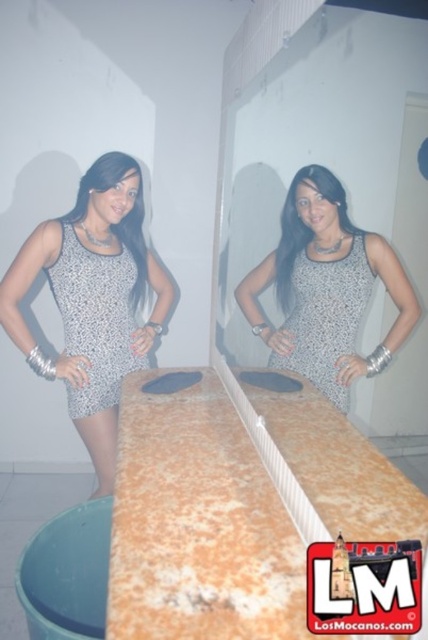
Where is the silver metallic dress at center located in the image? Please provide its coordinates as a point in the format of a tuple like this example format of 2D coordinates like this example format of 2D coordinates like this example format of 2D coordinates like this example format of 2D coordinates like this example format of 2D coordinates like this example format of 2D coordinates like this example format of 2D coordinates like this example format of 2D coordinates like this example format of 2D

The silver metallic dress at center is located at coordinates point (95, 320).

In the scene shown: You are a photographer trying to capture the speckled fabric dress at center. You are currently standing 6 feet away from the dress. Can you adjust your position to get a better closeup shot without moving the dress?

The speckled fabric dress at center and camera are 6.03 feet apart from each other. Since you are already at 6 feet away, you can move slightly closer to within 5 feet for a better closeup shot.

You are a photographer setting up for a photoshoot. You have a camera that requires a minimum distance of 24 inches between the subject and the camera to focus properly. You see the orange marble countertop at center and the speckled fabric dress at center in the scene. Can you focus on the subject at the required distance?

The orange marble countertop at center is 24.39 inches away from the speckled fabric dress at center. Since the required minimum distance is 24 inches, the camera can focus on the subject as the distance meets the requirement.